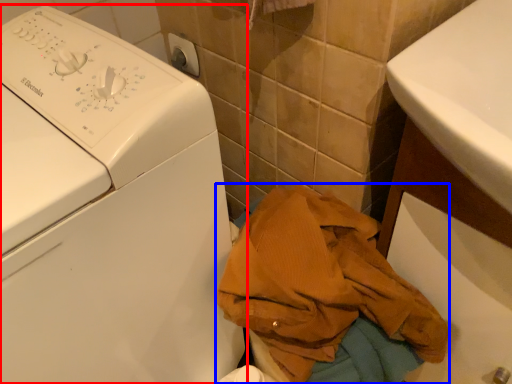
Question: Which object is closer to the camera taking this photo, washing machine (highlighted by a red box) or clothing (highlighted by a blue box)?

Choices:
 (A) washing machine
 (B) clothing

Answer: (A)